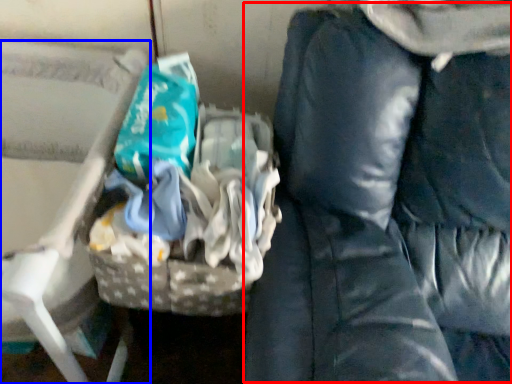
Question: Which object appears farthest to the camera in this image, bean bag chair (highlighted by a red box) or furniture (highlighted by a blue box)?

Choices:
 (A) bean bag chair
 (B) furniture

Answer: (B)